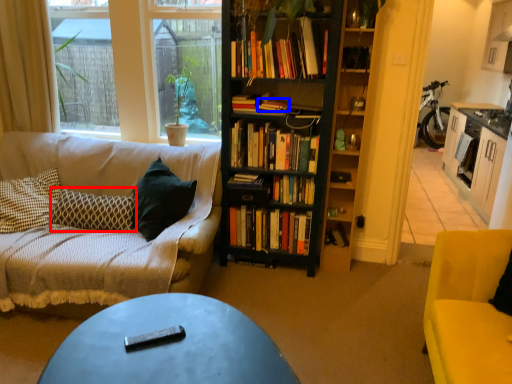
Question: Which point is closer to the camera, pillow (highlighted by a red box) or book (highlighted by a blue box)?

Choices:
 (A) pillow
 (B) book

Answer: (A)